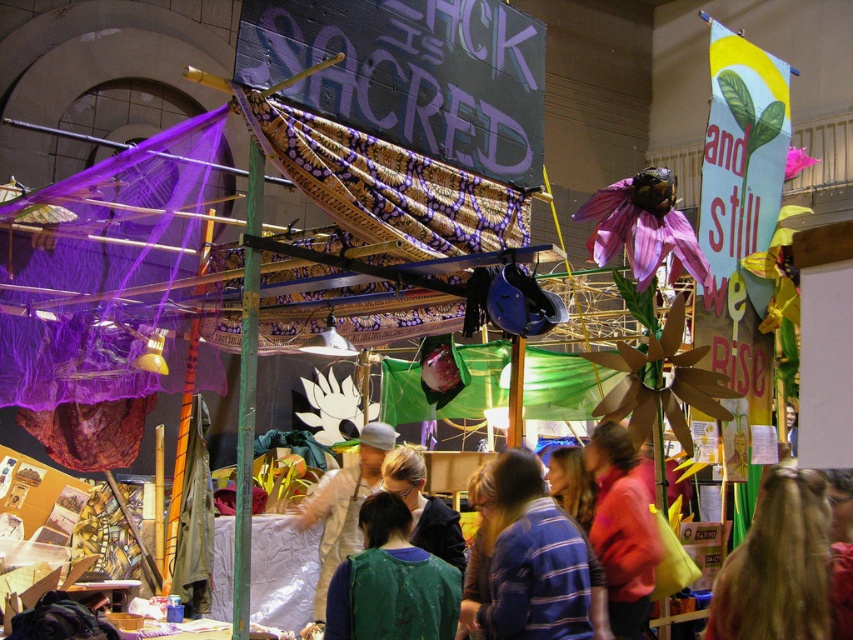
Is striped cotton shirt at center below light brown fabric at center?

No.

Which is behind, point (479, 600) or point (329, 509)?

Positioned behind is point (329, 509).

Who is more distant from viewer, (553, 584) or (350, 467)?

The point (350, 467) is more distant.

The height and width of the screenshot is (640, 853). I want to click on striped cotton shirt at center, so click(x=527, y=561).

Who is positioned more to the right, striped cotton shirt at center or blonde hair at center?

blonde hair at center

Is striped cotton shirt at center shorter than blonde hair at center?

Incorrect, striped cotton shirt at center's height does not fall short of blonde hair at center's.

The width and height of the screenshot is (853, 640). What are the coordinates of `striped cotton shirt at center` in the screenshot? It's located at (527, 561).

Consider the image. Which is above, green fabric at center or light brown fabric at center?

green fabric at center

Can you confirm if green fabric at center is bigger than light brown fabric at center?

No.

Who is more distant from viewer, (403, 538) or (347, 513)?

The point (347, 513) is more distant.

The width and height of the screenshot is (853, 640). In order to click on green fabric at center in this screenshot , I will do `click(392, 582)`.